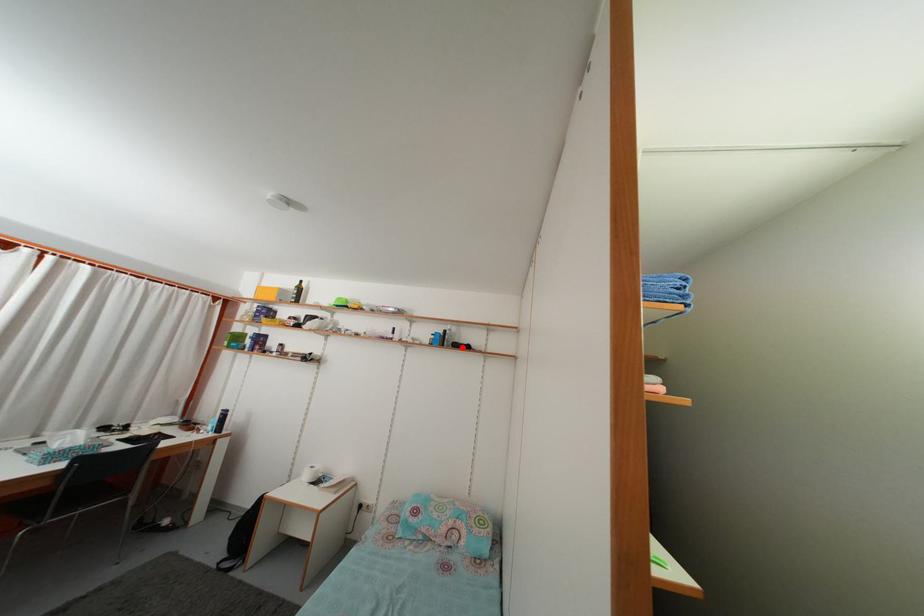
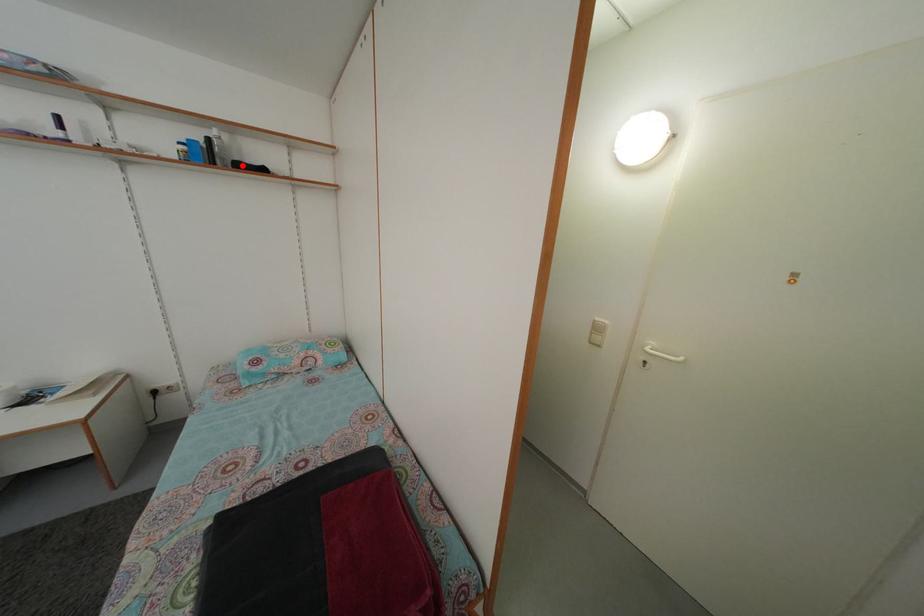
I am providing you with two images of the same scene from different viewpoints. A red point is marked on the first image and another point is marked on the second image. Are the points marked in image1 and image2 representing the same 3D position?

Yes